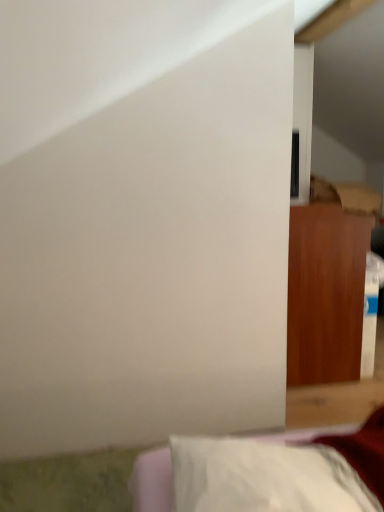
Question: Should I look upward or downward to see wooden cabinet at right, positioned as the first furniture in right-to-left order?

Choices:
 (A) up
 (B) down

Answer: (B)

Question: Is white fabric pillow at lower right, which appears as the first furniture when viewed from the front, positioned in front of wooden cabinet at right, which ranks as the second furniture in bottom-to-top order?

Choices:
 (A) no
 (B) yes

Answer: (B)

Question: Does white fabric pillow at lower right, marked as the first furniture in a left-to-right arrangement, appear on the right side of wooden cabinet at right, the first furniture in the back-to-front sequence?

Choices:
 (A) no
 (B) yes

Answer: (A)

Question: Does white fabric pillow at lower right, positioned as the first furniture in bottom-to-top order, have a lesser height compared to wooden cabinet at right, the first furniture in the back-to-front sequence?

Choices:
 (A) no
 (B) yes

Answer: (B)

Question: Is white fabric pillow at lower right, which is the second furniture in right-to-left order, smaller than wooden cabinet at right, which ranks as the second furniture in bottom-to-top order?

Choices:
 (A) no
 (B) yes

Answer: (B)

Question: Are white fabric pillow at lower right, which is the second furniture in right-to-left order, and wooden cabinet at right, placed as the 1th furniture when sorted from top to bottom, located far from each other?

Choices:
 (A) no
 (B) yes

Answer: (B)

Question: Considering the relative sizes of white fabric pillow at lower right, the 2th furniture in the back-to-front sequence, and wooden cabinet at right, placed as the 1th furniture when sorted from top to bottom, in the image provided, is white fabric pillow at lower right, the 2th furniture in the back-to-front sequence, taller than wooden cabinet at right, placed as the 1th furniture when sorted from top to bottom,?

Choices:
 (A) yes
 (B) no

Answer: (B)

Question: Is wooden cabinet at right, positioned as the second furniture in front-to-back order, wider than white fabric pillow at lower right, marked as the first furniture in a left-to-right arrangement?

Choices:
 (A) yes
 (B) no

Answer: (B)

Question: Are wooden cabinet at right, placed as the 1th furniture when sorted from top to bottom, and white fabric pillow at lower right, the 2th furniture in the back-to-front sequence, beside each other?

Choices:
 (A) no
 (B) yes

Answer: (A)

Question: From the image's perspective, is wooden cabinet at right, the second furniture positioned from the left, over white fabric pillow at lower right, which appears as the first furniture when viewed from the front?

Choices:
 (A) no
 (B) yes

Answer: (B)

Question: Is wooden cabinet at right, which ranks as the second furniture in bottom-to-top order, further to camera compared to white fabric pillow at lower right, placed as the 2th furniture when sorted from top to bottom?

Choices:
 (A) no
 (B) yes

Answer: (B)

Question: Considering the relative positions of wooden cabinet at right, positioned as the first furniture in right-to-left order, and white fabric pillow at lower right, placed as the 2th furniture when sorted from top to bottom, in the image provided, is wooden cabinet at right, positioned as the first furniture in right-to-left order, to the left of white fabric pillow at lower right, placed as the 2th furniture when sorted from top to bottom, from the viewer's perspective?

Choices:
 (A) yes
 (B) no

Answer: (B)

Question: Considering the relative sizes of wooden cabinet at right, positioned as the first furniture in right-to-left order, and white fabric pillow at lower right, which appears as the first furniture when viewed from the front, in the image provided, is wooden cabinet at right, positioned as the first furniture in right-to-left order, shorter than white fabric pillow at lower right, which appears as the first furniture when viewed from the front,?

Choices:
 (A) no
 (B) yes

Answer: (A)

Question: Is wooden cabinet at right, the second furniture positioned from the left, to the left or to the right of white fabric pillow at lower right, which is the second furniture in right-to-left order, in the image?

Choices:
 (A) left
 (B) right

Answer: (B)